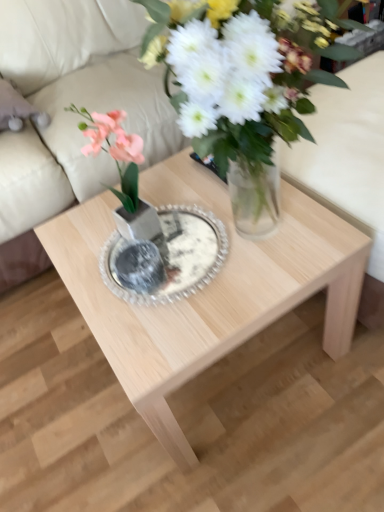
Question: From the image's perspective, is natural wood coffee table at center positioned above or below beige fabric couch at upper center?

Choices:
 (A) above
 (B) below

Answer: (B)

Question: In terms of size, does natural wood coffee table at center appear bigger or smaller than beige fabric couch at upper center?

Choices:
 (A) big
 (B) small

Answer: (B)

Question: Considering the real-world distances, which object is closest to the beige fabric couch at upper center?

Choices:
 (A) pink silk flower at center
 (B) natural wood coffee table at center
 (C) clear glass plate at center

Answer: (B)

Question: Considering the real-world distances, which object is farthest from the natural wood coffee table at center?

Choices:
 (A) clear glass plate at center
 (B) pink silk flower at center
 (C) beige fabric couch at upper center

Answer: (C)